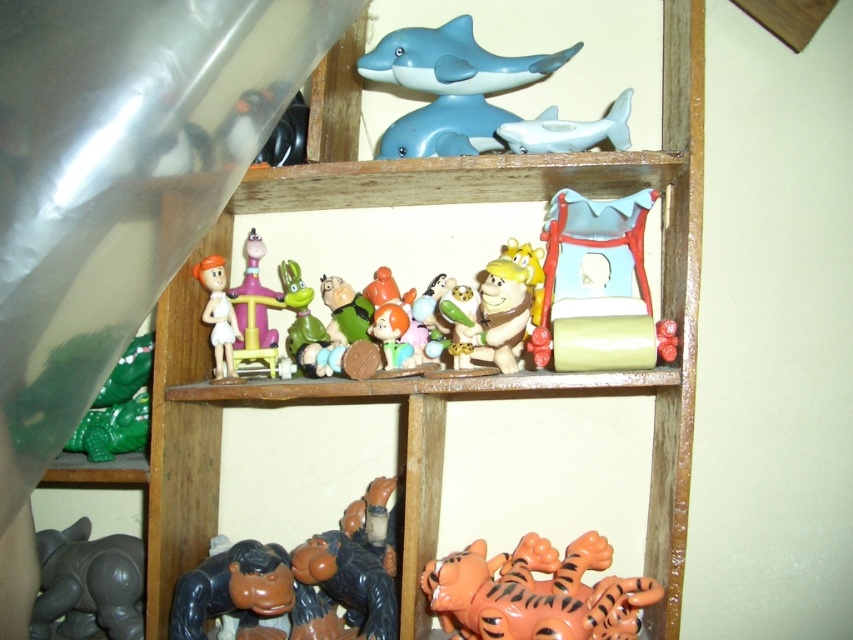
You are organizing a toy shelf and need to place a new toy between the orange matte tiger at lower center and the green matte toy at center. Based on their positions, which side should you place the new toy to keep it centered between them?

The orange matte tiger at lower center is to the right of the green matte toy at center, so placing the new toy to the left of the orange matte tiger at lower center and to the right of the green matte toy at center would keep it centered between them.